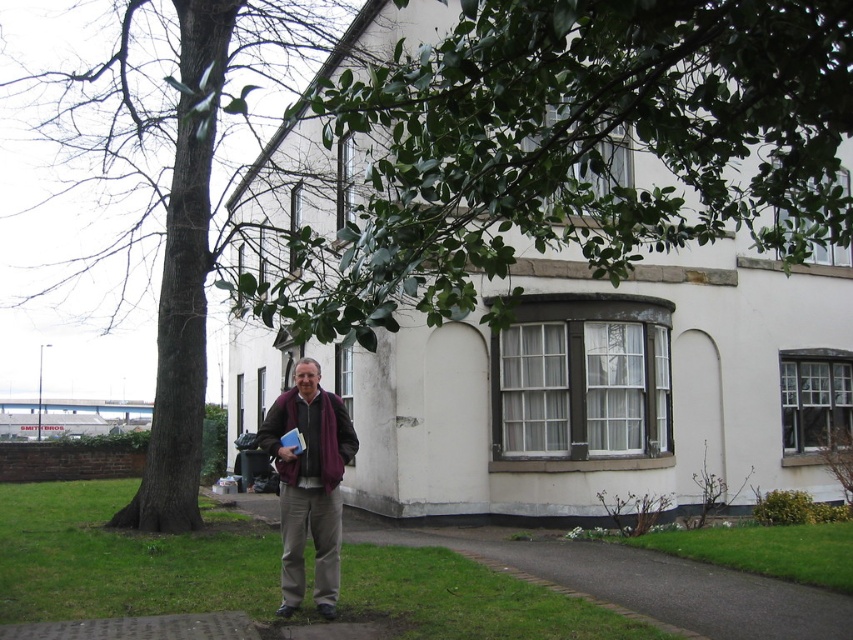
Does green leafy branch at upper center appear on the left side of maroon wool scarf at center?

In fact, green leafy branch at upper center is to the right of maroon wool scarf at center.

Between point (258, 296) and point (337, 413), which one is positioned behind?

Positioned behind is point (337, 413).

The height and width of the screenshot is (640, 853). I want to click on green leafy branch at upper center, so click(558, 152).

The height and width of the screenshot is (640, 853). Describe the element at coordinates (558, 152) in the screenshot. I see `green leafy branch at upper center` at that location.

Between point (486, 115) and point (97, 132), which one is positioned behind?

Point (97, 132)

This screenshot has width=853, height=640. What are the coordinates of `green leafy branch at upper center` in the screenshot? It's located at (558, 152).

Is green leafy tree at center above maroon wool scarf at center?

Yes.

Based on the photo, can you confirm if green leafy tree at center is positioned to the left of maroon wool scarf at center?

Indeed, green leafy tree at center is positioned on the left side of maroon wool scarf at center.

Does point (0, 76) lie in front of point (300, 468)?

No, it is not.

Find the location of a particular element. green leafy tree at center is located at coordinates (164, 182).